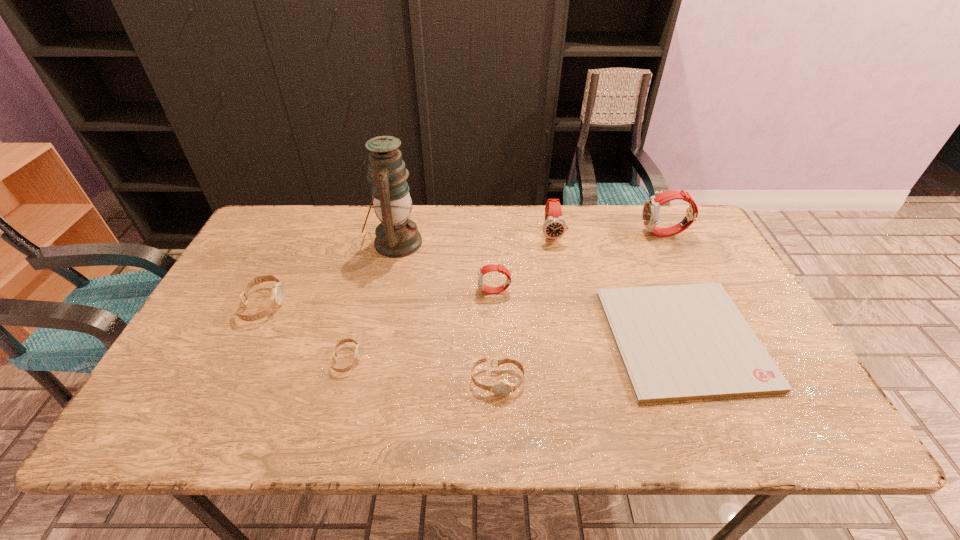
Choose which object is the third nearest neighbor to the clipboard. Please provide its 2D coordinates. Your answer should be formatted as a tuple, i.e. [(x, y)], where the tuple contains the x and y coordinates of a point satisfying the conditions above.

[(502, 387)]

Locate an element on the screen. This screenshot has height=540, width=960. watch that is the second nearest to the second beige watch from right to left is located at coordinates (502, 387).

This screenshot has width=960, height=540. In order to click on watch that is the fourth nearest to the second shortest watch in this screenshot , I will do `click(278, 291)`.

The image size is (960, 540). What are the coordinates of `the second closest red watch to the tallest watch` in the screenshot? It's located at (485, 269).

Select which red watch appears as the second closest to the shortest object. Please provide its 2D coordinates. Your answer should be formatted as a tuple, i.e. [(x, y)], where the tuple contains the x and y coordinates of a point satisfying the conditions above.

[(650, 214)]

Identify which beige watch is the nearest to the smallest beige watch. Please provide its 2D coordinates. Your answer should be formatted as a tuple, i.e. [(x, y)], where the tuple contains the x and y coordinates of a point satisfying the conditions above.

[(278, 291)]

The width and height of the screenshot is (960, 540). Find the location of `beige watch that is the third nearest to the third object from right to left`. beige watch that is the third nearest to the third object from right to left is located at coordinates click(278, 291).

At what (x,y) coordinates should I click in order to perform the action: click on vacant region that satisfies the following two spatial constraints: 1. on the front side of the oil lamp; 2. on the left side of the shortest object. Please return your answer as a coordinate pair (x, y). The image size is (960, 540). Looking at the image, I should click on (374, 339).

Find the location of a particular element. Image resolution: width=960 pixels, height=540 pixels. free space that satisfies the following two spatial constraints: 1. on the face of the shortest object; 2. on the right side of the second biggest red watch is located at coordinates (572, 339).

Identify the location of vacant area in the image that satisfies the following two spatial constraints: 1. on the face of the biggest beige watch; 2. on the back side of the clipboard. click(247, 339).